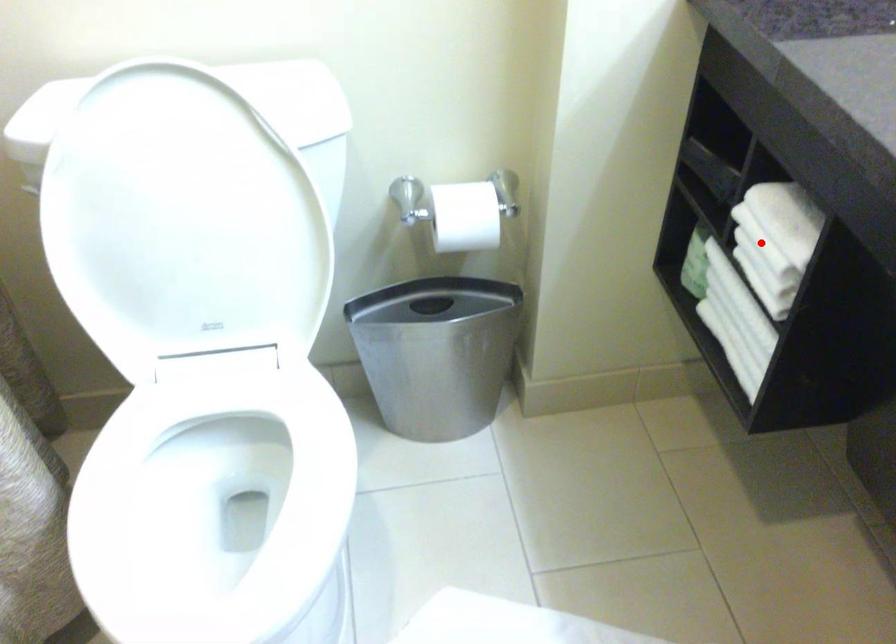
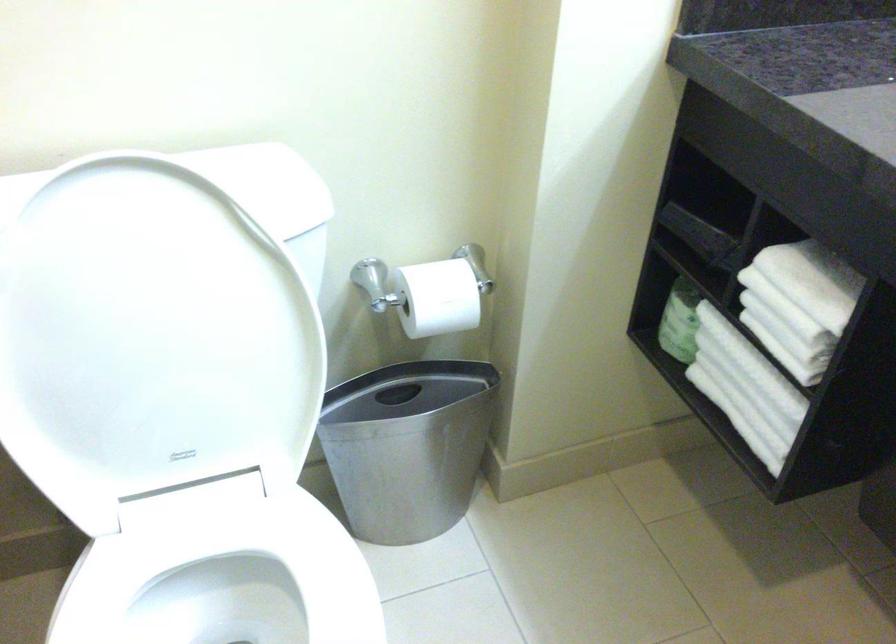
Find the pixel in the second image that matches the highlighted location in the first image.

(785, 308)